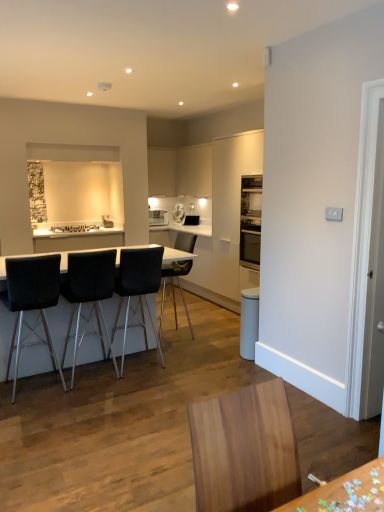
Question: In terms of height, does white glossy cabinet at upper center, placed as the 2th cabinetry when sorted from left to right, look taller or shorter compared to black fabric chair at left, which is the first chair from left to right?

Choices:
 (A) tall
 (B) short

Answer: (B)

Question: From the image's perspective, is white glossy cabinet at upper center, which is the first cabinetry in right-to-left order, positioned above or below black fabric chair at left, the fourth chair in the right-to-left sequence?

Choices:
 (A) above
 (B) below

Answer: (A)

Question: Estimate the real-world distances between objects in this image. Which object is closer to the white glossy cabinet at upper center, placed as the 2th cabinetry when sorted from left to right?

Choices:
 (A) white glossy table at center
 (B) black leather chair at center, marked as the fourth chair in a left-to-right arrangement
 (C) white glossy cabinet at upper center, placed as the first cabinetry when sorted from left to right
 (D) black fabric chair at left, which is the first chair from left to right
 (E) black leather chair at center, acting as the 2th chair starting from the left

Answer: (C)

Question: Estimate the real-world distances between objects in this image. Which object is farther from the white glossy cabinet at upper center, which is the first cabinetry in right-to-left order?

Choices:
 (A) black fabric chair at left, the fourth chair in the right-to-left sequence
 (B) white glossy cabinet at upper center, the 2th cabinetry viewed from the right
 (C) black leather chair at center, the third chair positioned from the left
 (D) white glossy coffee machine at center
 (E) white glossy microwave at upper center

Answer: (A)